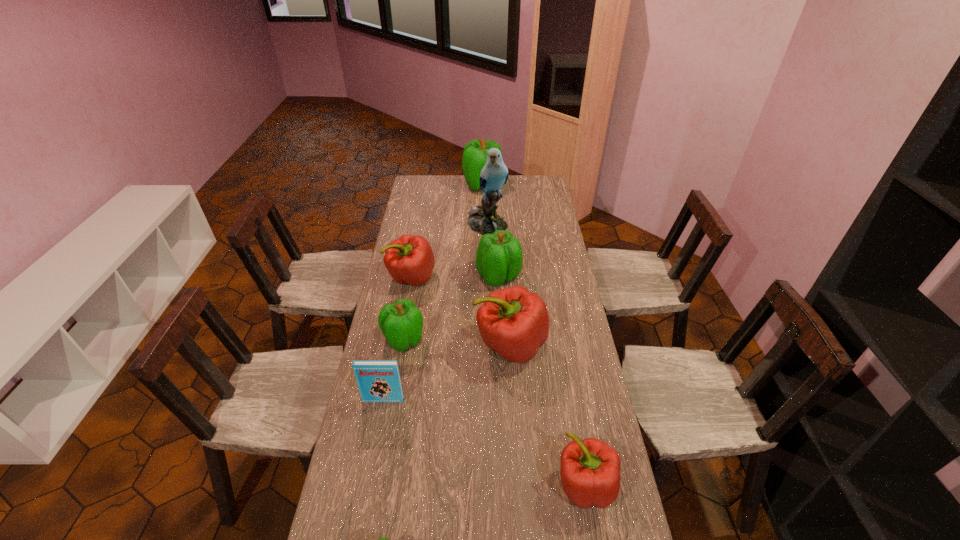
The height and width of the screenshot is (540, 960). In order to click on the tallest object in this screenshot , I will do `click(483, 219)`.

In order to click on parakeet in this screenshot , I will do (483, 219).

This screenshot has width=960, height=540. Identify the location of the farthest green bell pepper. pyautogui.click(x=474, y=158).

This screenshot has height=540, width=960. Find the location of `the farthest bell pepper`. the farthest bell pepper is located at coordinates (474, 158).

Where is `the biggest pink bell pepper`? the biggest pink bell pepper is located at coordinates (514, 322).

Locate an element on the screen. the second biggest green bell pepper is located at coordinates (499, 257).

Find the location of a particular element. The width and height of the screenshot is (960, 540). the leftmost pink bell pepper is located at coordinates (409, 259).

The width and height of the screenshot is (960, 540). I want to click on the farthest pink bell pepper, so click(x=409, y=259).

The width and height of the screenshot is (960, 540). Find the location of `book`. book is located at coordinates coord(379,381).

I want to click on the seventh farthest object, so click(379, 381).